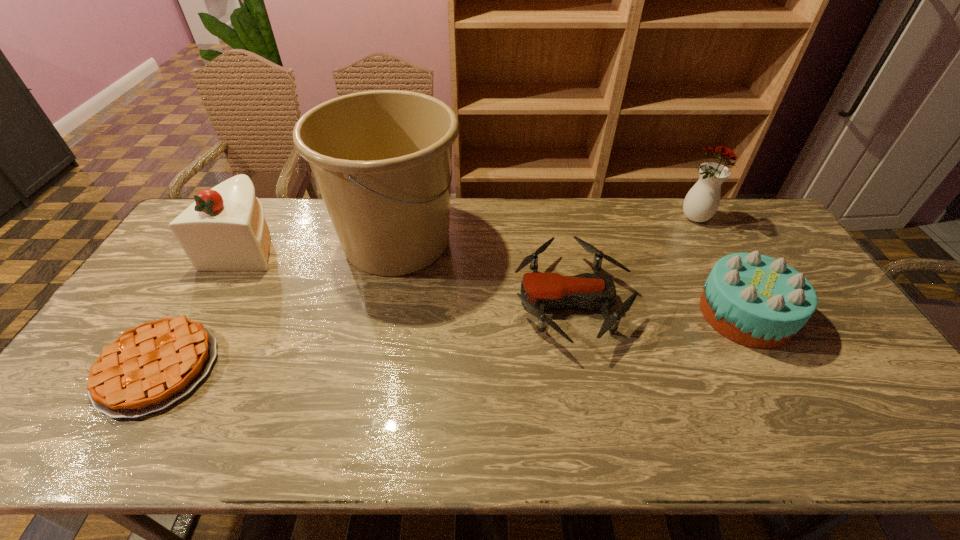
Locate an element on the screen. The width and height of the screenshot is (960, 540). cake that is at the far edge is located at coordinates (224, 229).

At what (x,y) coordinates should I click in order to perform the action: click on object that is at the near edge. Please return your answer as a coordinate pair (x, y). Looking at the image, I should click on (147, 368).

Where is `cake that is at the left edge`? cake that is at the left edge is located at coordinates (224, 229).

In order to click on pie that is at the left edge in this screenshot , I will do `click(147, 368)`.

Locate an element on the screen. This screenshot has width=960, height=540. object that is at the right edge is located at coordinates (757, 301).

Locate an element on the screen. This screenshot has height=540, width=960. object that is at the far left corner is located at coordinates (224, 229).

In order to click on object present at the near left corner in this screenshot , I will do `click(147, 368)`.

Locate an element on the screen. The height and width of the screenshot is (540, 960). vacant space at the far edge of the desktop is located at coordinates (662, 234).

The width and height of the screenshot is (960, 540). I want to click on free region at the near edge of the desktop, so click(178, 426).

Find the location of a particular element. blank area at the right edge is located at coordinates (834, 346).